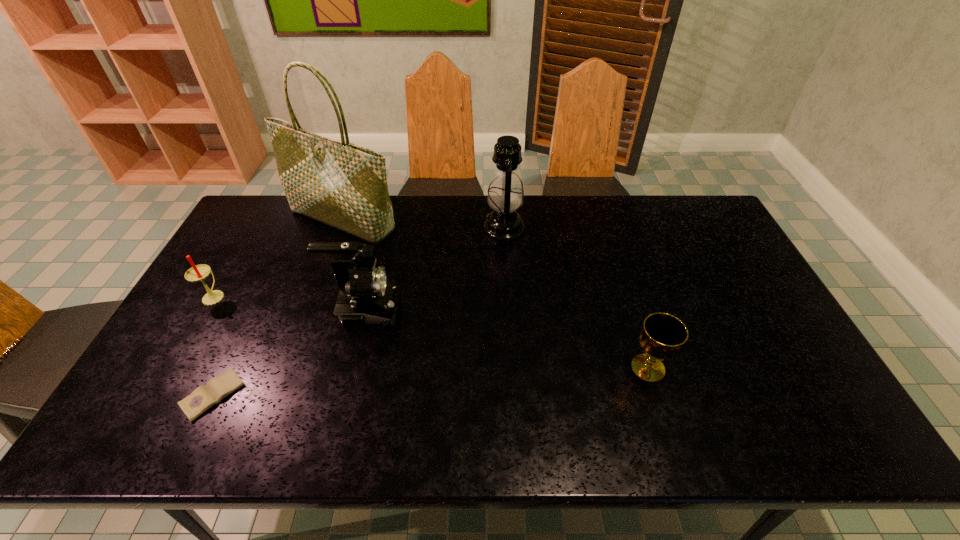
Where is `empty location between the oil lamp and the camcorder`? The height and width of the screenshot is (540, 960). empty location between the oil lamp and the camcorder is located at coordinates (435, 269).

The width and height of the screenshot is (960, 540). Find the location of `free spot between the camcorder and the candle`. free spot between the camcorder and the candle is located at coordinates (290, 303).

Locate an element on the screen. Image resolution: width=960 pixels, height=540 pixels. object that is the second closest one to the chalice is located at coordinates (366, 296).

I want to click on the second closest object to the shopping bag, so click(x=366, y=296).

Where is `free location that satisfies the following two spatial constraints: 1. on the front side of the rightmost object; 2. on the left side of the candle`? free location that satisfies the following two spatial constraints: 1. on the front side of the rightmost object; 2. on the left side of the candle is located at coordinates [x=173, y=368].

Locate an element on the screen. This screenshot has height=540, width=960. vacant point that satisfies the following two spatial constraints: 1. on the front side of the leftmost object; 2. on the left side of the shortest object is located at coordinates (x=157, y=395).

Image resolution: width=960 pixels, height=540 pixels. Find the location of `vacant point that satisfies the following two spatial constraints: 1. on the lens mount of the chalice; 2. on the left side of the camcorder`. vacant point that satisfies the following two spatial constraints: 1. on the lens mount of the chalice; 2. on the left side of the camcorder is located at coordinates (352, 368).

Locate an element on the screen. vacant space that satisfies the following two spatial constraints: 1. on the front side of the leftmost object; 2. on the left side of the chalice is located at coordinates (173, 368).

The height and width of the screenshot is (540, 960). Find the location of `free space that satisfies the following two spatial constraints: 1. on the lens mount of the rightmost object; 2. on the right side of the fourth shortest object`. free space that satisfies the following two spatial constraints: 1. on the lens mount of the rightmost object; 2. on the right side of the fourth shortest object is located at coordinates pos(352,368).

Find the location of a particular element. vacant area in the image that satisfies the following two spatial constraints: 1. on the lens mount of the fourth shortest object; 2. on the left side of the rightmost object is located at coordinates (352, 368).